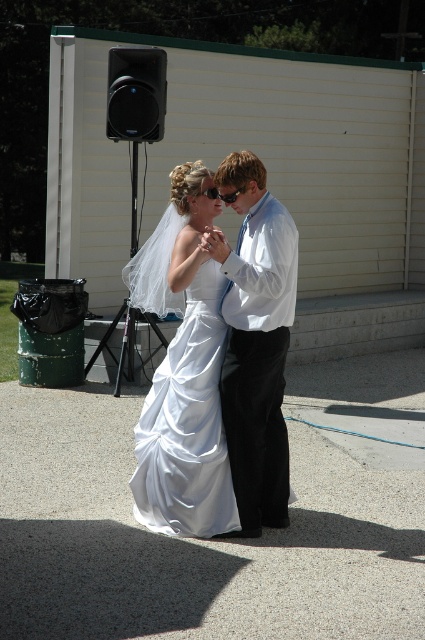
Between point (183, 467) and point (110, 100), which one is positioned in front?

Positioned in front is point (183, 467).

Is point (138, 420) closer to camera compared to point (138, 120)?

Yes, it is in front of point (138, 120).

Measure the distance between satin white dress at center and camera.

They are 19.03 feet apart.

Find the location of a particular element. This screenshot has width=425, height=640. satin white dress at center is located at coordinates (187, 424).

Identify the location of white satin shirt at center. The width and height of the screenshot is (425, 640). (255, 340).

Does point (257, 408) lie in front of point (186, 493)?

No, it is not.

Is point (272, 259) less distant than point (224, 442)?

Yes, point (272, 259) is closer to viewer.

The width and height of the screenshot is (425, 640). Identify the location of white satin shirt at center. (255, 340).

Who is positioned more to the right, white satin shirt at center or black plastic speaker at upper left?

From the viewer's perspective, white satin shirt at center appears more on the right side.

Between point (248, 157) and point (153, 58), which one is positioned behind?

Positioned behind is point (153, 58).

Locate an element on the screen. The image size is (425, 640). white satin shirt at center is located at coordinates (255, 340).